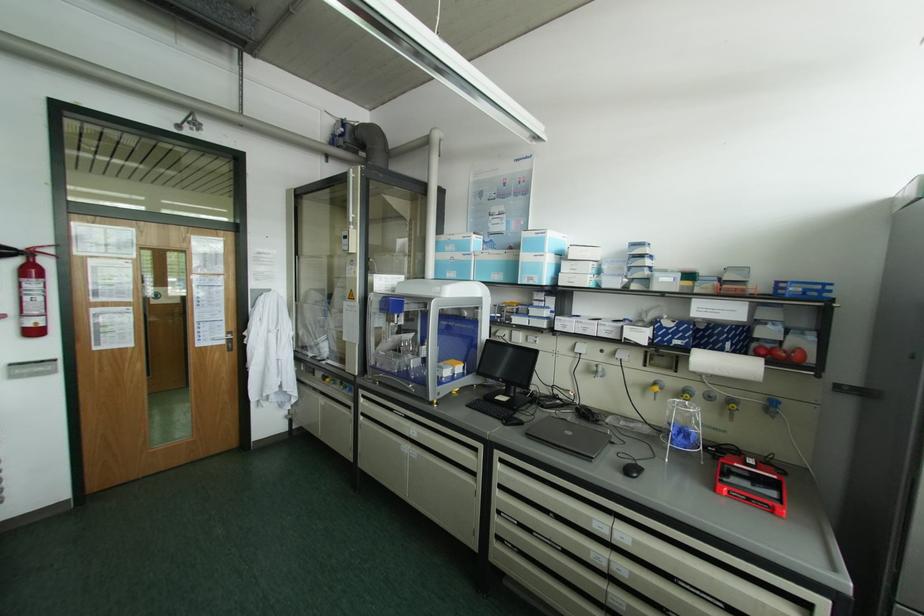
This screenshot has height=616, width=924. Describe the element at coordinates (725, 363) in the screenshot. I see `the paper towel roll` at that location.